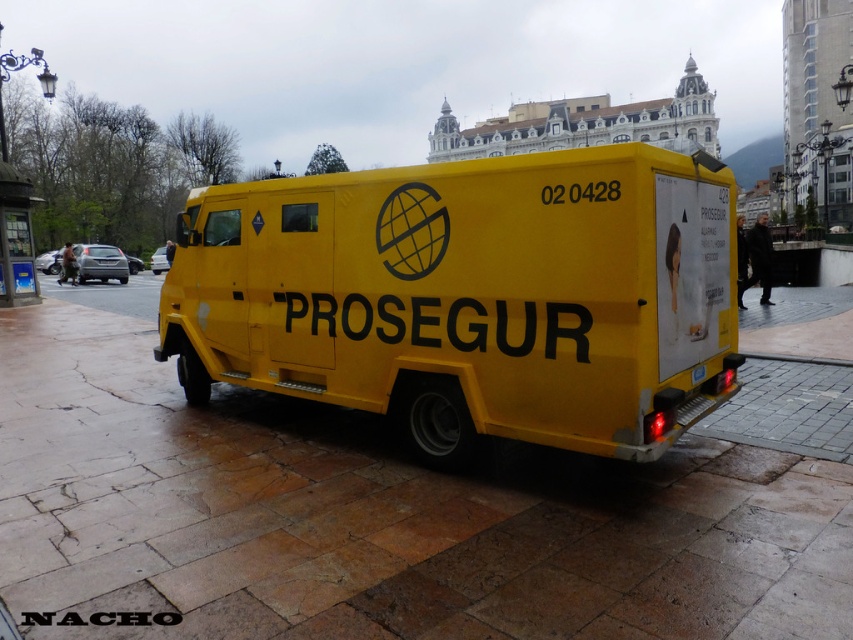
Question: Which of the following is the closest to the observer?

Choices:
 (A) yellow matte van at center
 (B) yellow concrete pavement at center

Answer: (B)

Question: Which of the following is the closest to the observer?

Choices:
 (A) (393, 276)
 (B) (236, 593)

Answer: (B)

Question: Can you confirm if yellow concrete pavement at center is positioned above yellow matte van at center?

Choices:
 (A) no
 (B) yes

Answer: (A)

Question: Is yellow concrete pavement at center bigger than yellow matte van at center?

Choices:
 (A) yes
 (B) no

Answer: (A)

Question: Is yellow concrete pavement at center positioned in front of yellow matte van at center?

Choices:
 (A) no
 (B) yes

Answer: (B)